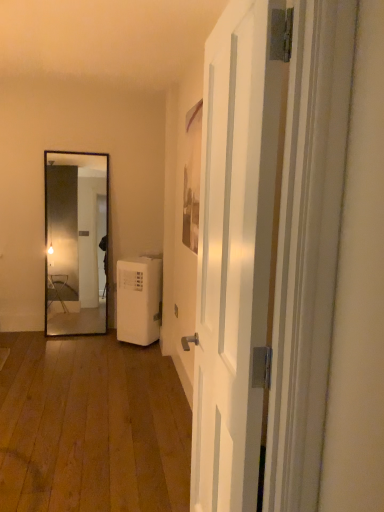
Question: Are white plastic water heater at lower center and white glossy door at center located far from each other?

Choices:
 (A) no
 (B) yes

Answer: (B)

Question: Is white plastic water heater at lower center beside white glossy door at center?

Choices:
 (A) yes
 (B) no

Answer: (B)

Question: Is white plastic water heater at lower center thinner than white glossy door at center?

Choices:
 (A) no
 (B) yes

Answer: (A)

Question: Can you confirm if white plastic water heater at lower center is smaller than white glossy door at center?

Choices:
 (A) yes
 (B) no

Answer: (A)

Question: Does white plastic water heater at lower center have a lesser height compared to white glossy door at center?

Choices:
 (A) no
 (B) yes

Answer: (B)

Question: From the image's perspective, would you say white plastic water heater at lower center is positioned over white glossy door at center?

Choices:
 (A) yes
 (B) no

Answer: (B)

Question: Would you consider white glossy door at center to be distant from white plastic water heater at lower center?

Choices:
 (A) no
 (B) yes

Answer: (B)

Question: Does white glossy door at center have a lesser width compared to white plastic water heater at lower center?

Choices:
 (A) yes
 (B) no

Answer: (A)

Question: Is the depth of white glossy door at center greater than that of white plastic water heater at lower center?

Choices:
 (A) no
 (B) yes

Answer: (A)

Question: From the image's perspective, is white glossy door at center over white plastic water heater at lower center?

Choices:
 (A) yes
 (B) no

Answer: (A)

Question: From a real-world perspective, is white glossy door at center located beneath white plastic water heater at lower center?

Choices:
 (A) no
 (B) yes

Answer: (A)

Question: Is white glossy door at center facing away from white plastic water heater at lower center?

Choices:
 (A) yes
 (B) no

Answer: (B)

Question: Looking at the image, does white glossy door at center seem bigger or smaller compared to white plastic water heater at lower center?

Choices:
 (A) big
 (B) small

Answer: (A)